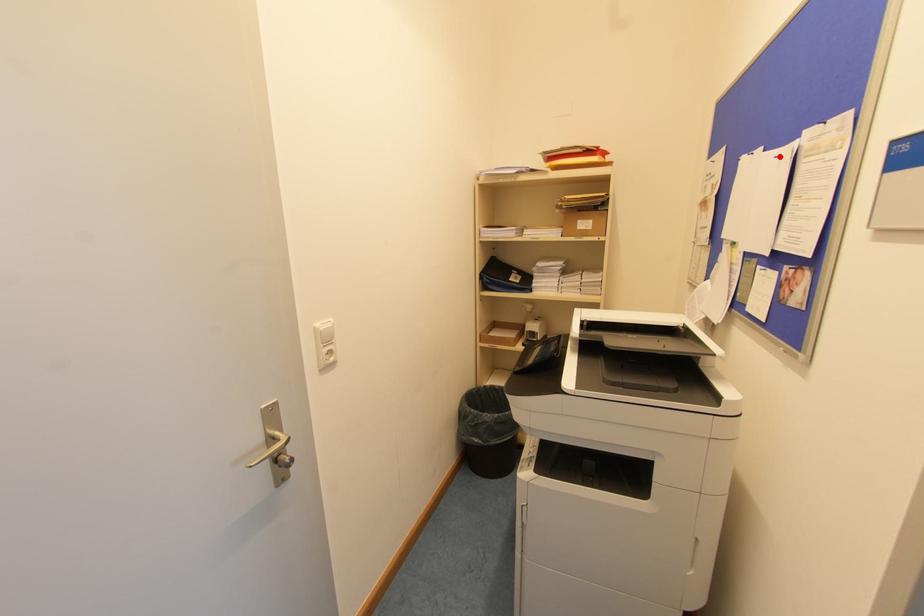
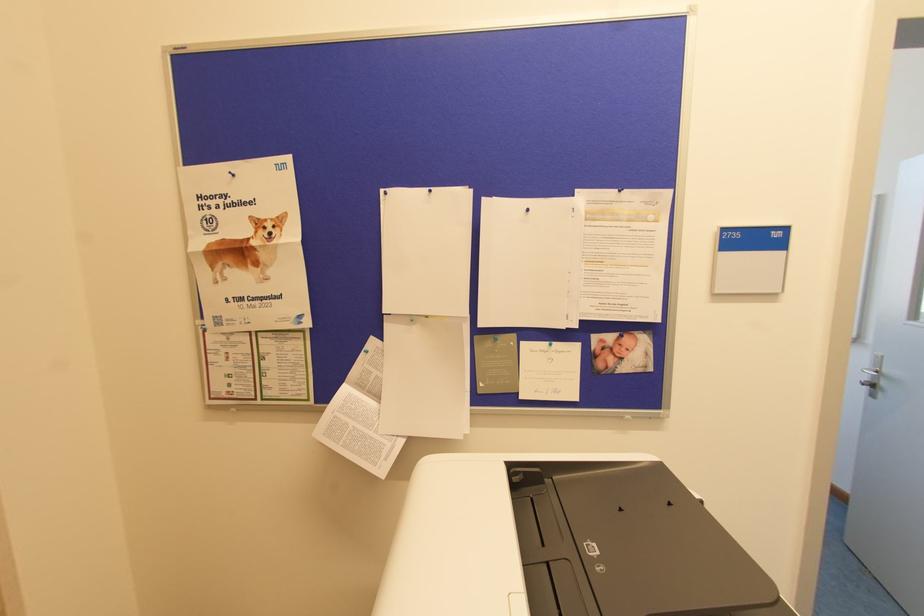
Locate, in the second image, the point that corresponds to the highlighted location in the first image.

(527, 209)